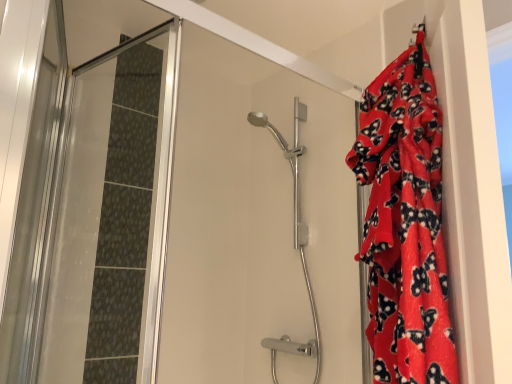
Question: From a real-world perspective, is transparent glass shower door at left located beneath red fleece blanket at right?

Choices:
 (A) no
 (B) yes

Answer: (B)

Question: Is transparent glass shower door at left closer to camera compared to red fleece blanket at right?

Choices:
 (A) no
 (B) yes

Answer: (A)

Question: Considering the relative sizes of transparent glass shower door at left and red fleece blanket at right in the image provided, is transparent glass shower door at left smaller than red fleece blanket at right?

Choices:
 (A) yes
 (B) no

Answer: (A)

Question: Could you tell me if transparent glass shower door at left is turned towards red fleece blanket at right?

Choices:
 (A) no
 (B) yes

Answer: (A)

Question: Can you confirm if transparent glass shower door at left is wider than red fleece blanket at right?

Choices:
 (A) yes
 (B) no

Answer: (A)

Question: Is red fleece blanket at right surrounded by transparent glass shower door at left?

Choices:
 (A) no
 (B) yes

Answer: (A)

Question: Is polished chrome shower head at center facing towards transparent glass shower door at left?

Choices:
 (A) no
 (B) yes

Answer: (B)

Question: From a real-world perspective, is polished chrome shower head at center below transparent glass shower door at left?

Choices:
 (A) yes
 (B) no

Answer: (B)

Question: From the image's perspective, is polished chrome shower head at center beneath transparent glass shower door at left?

Choices:
 (A) no
 (B) yes

Answer: (B)

Question: Is polished chrome shower head at center wider than transparent glass shower door at left?

Choices:
 (A) no
 (B) yes

Answer: (A)

Question: Is polished chrome shower head at center at the right side of transparent glass shower door at left?

Choices:
 (A) no
 (B) yes

Answer: (B)

Question: Is transparent glass shower door at left completely or partially inside polished chrome shower head at center?

Choices:
 (A) no
 (B) yes

Answer: (A)

Question: Is red fleece blanket at right bigger than transparent glass shower door at left?

Choices:
 (A) no
 (B) yes

Answer: (B)